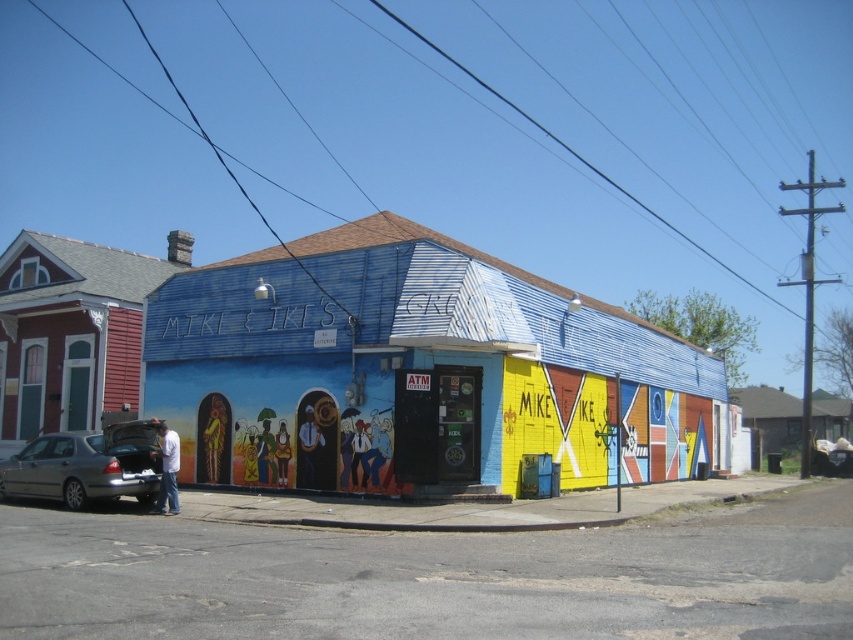
Who is positioned more to the left, blue painted building at center or light blue jeans at lower left?

From the viewer's perspective, light blue jeans at lower left appears more on the left side.

From the picture: Does blue painted building at center have a greater height compared to light blue jeans at lower left?

Yes, blue painted building at center is taller than light blue jeans at lower left.

Is point (643, 333) farther from camera compared to point (161, 497)?

That is True.

Find the location of a particular element. The height and width of the screenshot is (640, 853). blue painted building at center is located at coordinates (415, 371).

Between point (125, 493) and point (167, 468), which one is positioned behind?

The point (125, 493) is behind.

Describe the element at coordinates (84, 467) in the screenshot. Image resolution: width=853 pixels, height=640 pixels. I see `metallic gray sedan at lower left` at that location.

You are a GUI agent. You are given a task and a screenshot of the screen. Output one action in this format:
    pyautogui.click(x=<x>, y=<y>)
    Task: Click on the metallic gray sedan at lower left
    This screenshot has width=853, height=640.
    Given the screenshot: What is the action you would take?
    pyautogui.click(x=84, y=467)

Describe the element at coordinates (415, 371) in the screenshot. I see `blue painted building at center` at that location.

Is point (201, 346) positioned behind point (13, 496)?

Yes, point (201, 346) is behind point (13, 496).

Identify the location of blue painted building at center. (415, 371).